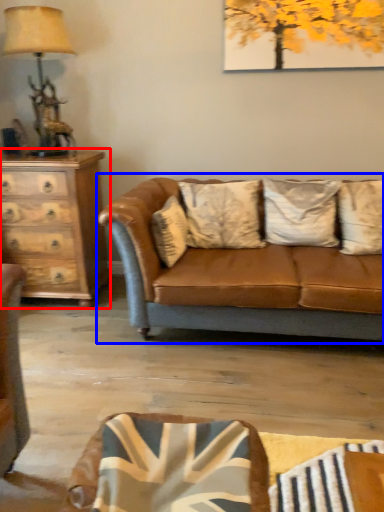
Question: Which of the following is the farthest to the observer, chest of drawers (highlighted by a red box) or studio couch (highlighted by a blue box)?

Choices:
 (A) chest of drawers
 (B) studio couch

Answer: (A)